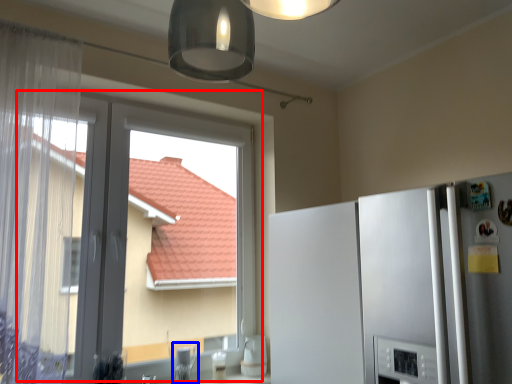
Question: Which object appears farthest to the camera in this image, window (highlighted by a red box) or appliance (highlighted by a blue box)?

Choices:
 (A) window
 (B) appliance

Answer: (B)